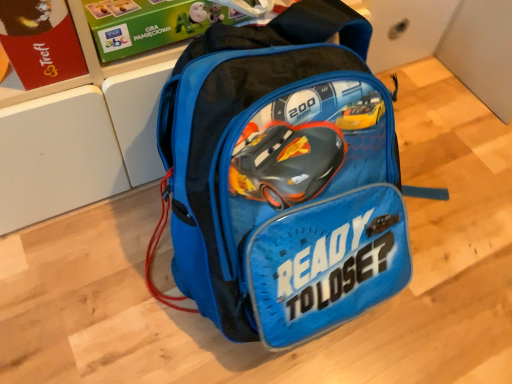
Where is `blue fabric backpack at center`? blue fabric backpack at center is located at coordinates (282, 177).

What is the approximate height of blue fabric backpack at center?

It is 13.60 inches.

Measure the distance between point [390,279] and camera.

The distance of point [390,279] from camera is 23.03 inches.

The image size is (512, 384). What do you see at coordinates (282, 177) in the screenshot? I see `blue fabric backpack at center` at bounding box center [282, 177].

Identify the location of blue fabric backpack at center. (282, 177).